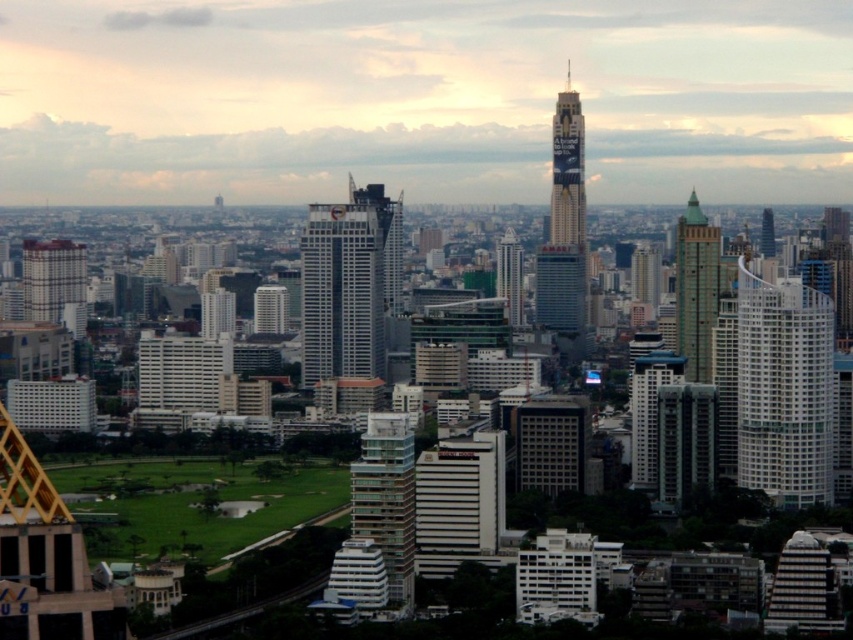
Does white glass skyscraper at center have a lesser width compared to glassy silver skyscraper at center?

In fact, white glass skyscraper at center might be wider than glassy silver skyscraper at center.

Is white glass skyscraper at center bigger than glassy silver skyscraper at center?

Incorrect, white glass skyscraper at center is not larger than glassy silver skyscraper at center.

In order to click on white glass skyscraper at center in this screenshot , I will do `click(349, 284)`.

Is matte glass skyscraper at left above green glass skyscraper at center?

Incorrect, matte glass skyscraper at left is not positioned above green glass skyscraper at center.

Is matte glass skyscraper at left taller than green glass skyscraper at center?

In fact, matte glass skyscraper at left may be shorter than green glass skyscraper at center.

Locate an element on the screen. The height and width of the screenshot is (640, 853). matte glass skyscraper at left is located at coordinates (51, 276).

Does point (380, 204) lie behind point (567, 166)?

That is False.

Is white glass skyscraper at center thinner than metallic glass skyscraper at center?

No, white glass skyscraper at center is not thinner than metallic glass skyscraper at center.

Who is more forward, (350, 252) or (569, 216)?

Point (350, 252) is more forward.

This screenshot has width=853, height=640. Identify the location of white glass skyscraper at center. (349, 284).